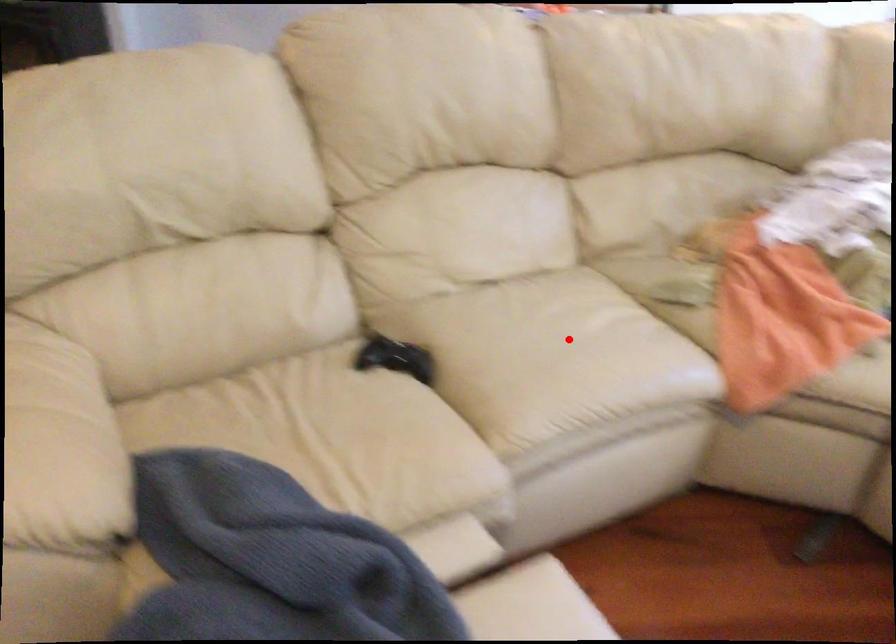
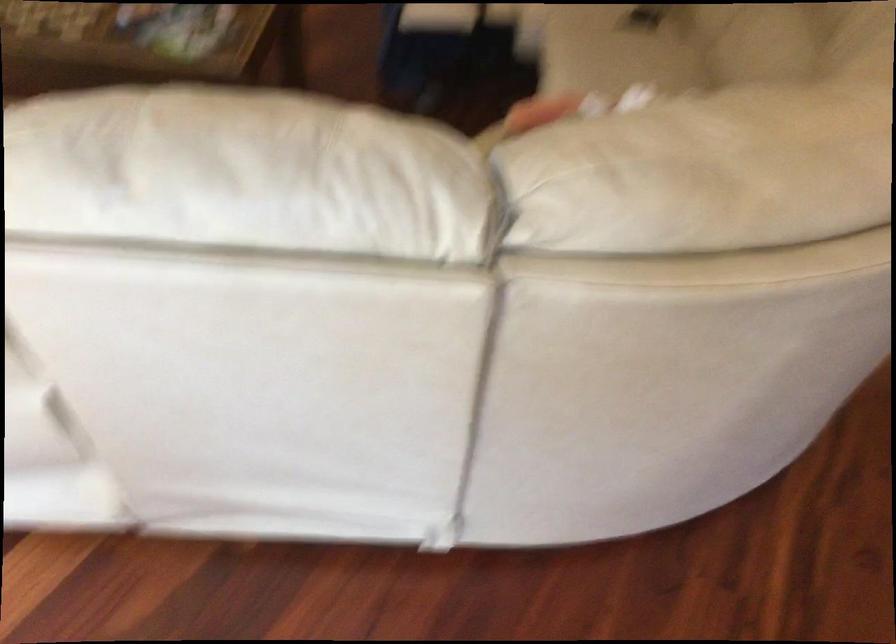
In the second image, find the point that corresponds to the highlighted location in the first image.

(616, 49)